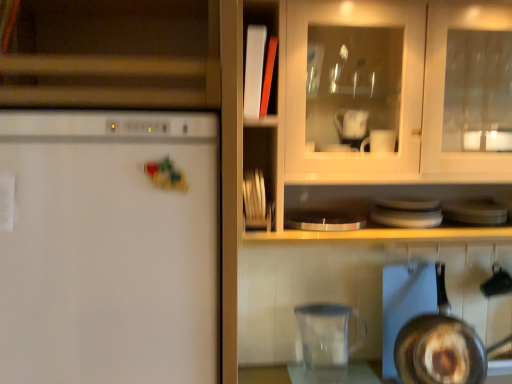
Describe the element at coordinates (441, 346) in the screenshot. I see `shiny silver frying pan at lower right` at that location.

From the picture: Measure the distance between shiny silver frying pan at lower right and camera.

The distance of shiny silver frying pan at lower right from camera is 1.29 meters.

In order to click on transparent plastic pitcher at lower center in this screenshot , I will do `click(328, 335)`.

Considering their positions, is transparent plastic pitcher at lower center located in front of or behind white matte refrigerator at left?

Clearly, transparent plastic pitcher at lower center is behind white matte refrigerator at left.

Find the location of a particular element. This screenshot has height=384, width=512. refrigerator above the transparent plastic pitcher at lower center (from the image's perspective) is located at coordinates (108, 247).

Considering the sizes of objects transparent plastic pitcher at lower center and white matte refrigerator at left in the image provided, who is smaller, transparent plastic pitcher at lower center or white matte refrigerator at left?

Smaller between the two is transparent plastic pitcher at lower center.

Between matte wood cabinet at upper left and white matte refrigerator at left, which one has larger width?

white matte refrigerator at left is wider.

Where is `refrigerator below the matte wood cabinet at upper left (from the image's perspective)`? The width and height of the screenshot is (512, 384). refrigerator below the matte wood cabinet at upper left (from the image's perspective) is located at coordinates (108, 247).

From a real-world perspective, is matte wood cabinet at upper left located higher than white matte refrigerator at left?

Yes, from a real-world perspective, matte wood cabinet at upper left is on top of white matte refrigerator at left.

Which object is positioned more to the left, matte wood cabinet at upper left or white matte refrigerator at left?

white matte refrigerator at left is more to the left.

Considering the sizes of objects matte wood cabinet at upper left and shiny silver frying pan at lower right in the image provided, who is wider, matte wood cabinet at upper left or shiny silver frying pan at lower right?

Wider between the two is matte wood cabinet at upper left.

Are matte wood cabinet at upper left and shiny silver frying pan at lower right far apart?

Yes, matte wood cabinet at upper left is far from shiny silver frying pan at lower right.

Is point (28, 62) closer to viewer compared to point (448, 310)?

Yes, point (28, 62) is in front of point (448, 310).

Is shiny silver frying pan at lower right wider than white matte refrigerator at left?

In fact, shiny silver frying pan at lower right might be narrower than white matte refrigerator at left.

Based on their positions, is shiny silver frying pan at lower right located to the left or right of white matte refrigerator at left?

Based on their positions, shiny silver frying pan at lower right is located to the right of white matte refrigerator at left.

Looking at the image, does shiny silver frying pan at lower right seem bigger or smaller compared to white matte refrigerator at left?

shiny silver frying pan at lower right is smaller than white matte refrigerator at left.

From the image's perspective, is matte wood cabinet at upper left beneath transparent plastic pitcher at lower center?

No.

Can you see matte wood cabinet at upper left touching transparent plastic pitcher at lower center?

There is a gap between matte wood cabinet at upper left and transparent plastic pitcher at lower center.

From a real-world perspective, is matte wood cabinet at upper left above or below transparent plastic pitcher at lower center?

From a real-world perspective, matte wood cabinet at upper left is physically above transparent plastic pitcher at lower center.

Is white matte refrigerator at left looking in the opposite direction of shiny silver frying pan at lower right?

white matte refrigerator at left is not turned away from shiny silver frying pan at lower right.

Based on the photo, does white matte refrigerator at left come behind shiny silver frying pan at lower right?

No, white matte refrigerator at left is in front of shiny silver frying pan at lower right.

Considering the sizes of objects white matte refrigerator at left and shiny silver frying pan at lower right in the image provided, who is thinner, white matte refrigerator at left or shiny silver frying pan at lower right?

shiny silver frying pan at lower right is thinner.

Considering the relative sizes of shiny silver frying pan at lower right and transparent plastic pitcher at lower center in the image provided, is shiny silver frying pan at lower right bigger than transparent plastic pitcher at lower center?

Indeed, shiny silver frying pan at lower right has a larger size compared to transparent plastic pitcher at lower center.

Find the location of a particular element. frying pan in front of the transparent plastic pitcher at lower center is located at coordinates (441, 346).

In terms of width, does shiny silver frying pan at lower right look wider or thinner when compared to transparent plastic pitcher at lower center?

In the image, shiny silver frying pan at lower right appears to be wider than transparent plastic pitcher at lower center.

Is shiny silver frying pan at lower right outside of transparent plastic pitcher at lower center?

Yes.

Identify the location of appliance that is on the right side of white matte refrigerator at left. Image resolution: width=512 pixels, height=384 pixels. (328, 335).

The image size is (512, 384). I want to click on cabinetry above the white matte refrigerator at left (from a real-world perspective), so (x=114, y=54).

From the image, which object appears to be nearer to shiny silver frying pan at lower right, white matte refrigerator at left or matte wood cabinet at upper left?

white matte refrigerator at left is positioned closer to the anchor shiny silver frying pan at lower right.

Based on their spatial positions, is shiny silver frying pan at lower right or white matte refrigerator at left further from matte wood cabinet at upper left?

Among the two, shiny silver frying pan at lower right is located further to matte wood cabinet at upper left.

Estimate the real-world distances between objects in this image. Which object is further from transparent plastic pitcher at lower center, shiny silver frying pan at lower right or white matte refrigerator at left?

The object further to transparent plastic pitcher at lower center is white matte refrigerator at left.

Looking at the image, which one is located closer to shiny silver frying pan at lower right, matte wood cabinet at upper left or transparent plastic pitcher at lower center?

Among the two, transparent plastic pitcher at lower center is located nearer to shiny silver frying pan at lower right.

When comparing their distances from transparent plastic pitcher at lower center, does white matte refrigerator at left or shiny silver frying pan at lower right seem further?

white matte refrigerator at left.

Considering their positions, is shiny silver frying pan at lower right positioned further to white matte refrigerator at left than transparent plastic pitcher at lower center?

Based on the image, shiny silver frying pan at lower right appears to be further to white matte refrigerator at left.

Estimate the real-world distances between objects in this image. Which object is further from matte wood cabinet at upper left, transparent plastic pitcher at lower center or shiny silver frying pan at lower right?

Based on the image, shiny silver frying pan at lower right appears to be further to matte wood cabinet at upper left.

Looking at the image, which one is located closer to shiny silver frying pan at lower right, transparent plastic pitcher at lower center or white matte refrigerator at left?

Based on the image, transparent plastic pitcher at lower center appears to be nearer to shiny silver frying pan at lower right.

The height and width of the screenshot is (384, 512). Identify the location of refrigerator between matte wood cabinet at upper left and transparent plastic pitcher at lower center vertically. (108, 247).

You are a GUI agent. You are given a task and a screenshot of the screen. Output one action in this format:
    pyautogui.click(x=<x>, y=<y>)
    Task: Click on the appliance situated between white matte refrigerator at left and shiny silver frying pan at lower right from left to right
    
    Given the screenshot: What is the action you would take?
    pyautogui.click(x=328, y=335)

Identify the location of appliance between matte wood cabinet at upper left and shiny silver frying pan at lower right in the horizontal direction. This screenshot has height=384, width=512. (328, 335).

Find the location of a particular element. cabinetry between white matte refrigerator at left and shiny silver frying pan at lower right is located at coordinates (114, 54).